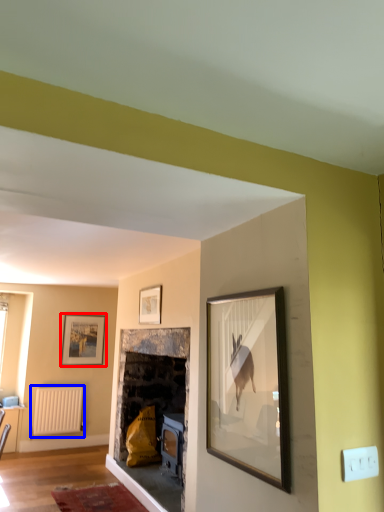
Question: Which of the following is the farthest to the observer, picture frame (highlighted by a red box) or radiator (highlighted by a blue box)?

Choices:
 (A) picture frame
 (B) radiator

Answer: (A)